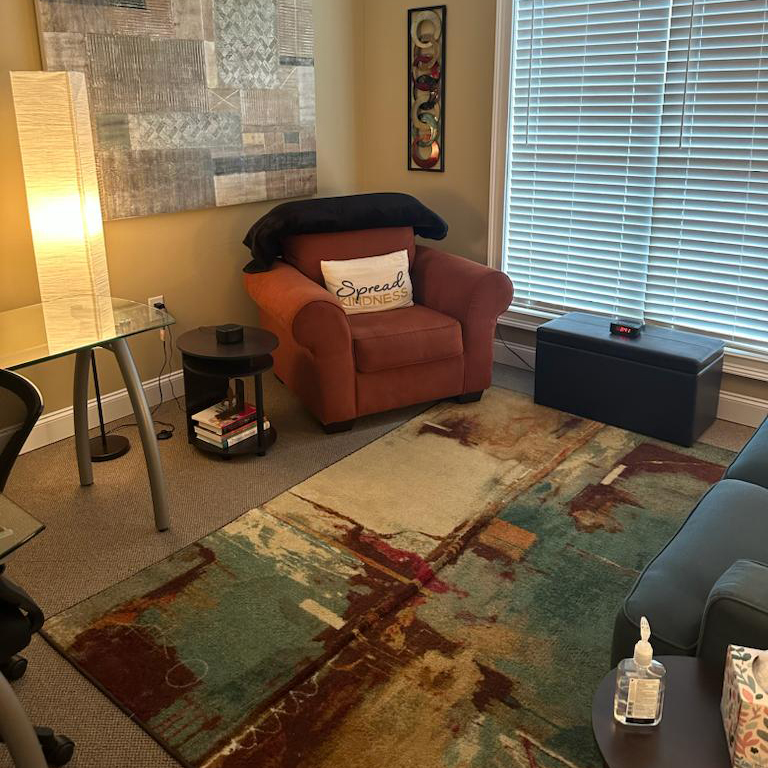
Locate an element on the screen. glass table is located at coordinates (77, 323).